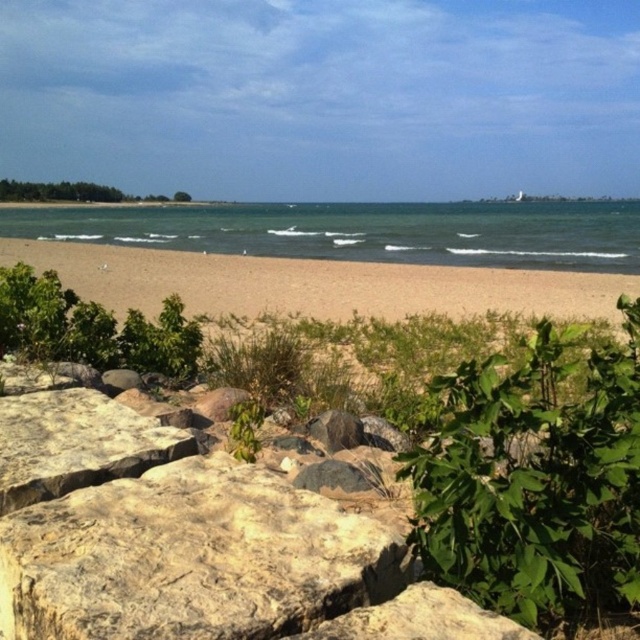
Question: In this image, where is brown rough rock at lower left located relative to green leafy bush at lower left?

Choices:
 (A) right
 (B) left

Answer: (A)

Question: Can you confirm if brown sandy beach at center is smaller than rough textured rock at lower left?

Choices:
 (A) yes
 (B) no

Answer: (B)

Question: Does brown sandy beach at center appear under rough textured rock at lower left?

Choices:
 (A) no
 (B) yes

Answer: (A)

Question: Among these objects, which one is farthest from the camera?

Choices:
 (A) brown sandy beach at center
 (B) smooth gray rock at center
 (C) green leafy plant at center
 (D) green leafy bush at lower left

Answer: (A)

Question: Based on their relative distances, which object is nearer to the green leafy shrubs at left?

Choices:
 (A) brown rough rock at lower left
 (B) smooth gray rock at center

Answer: (A)

Question: Among these points, which one is farthest from the camera?

Choices:
 (A) (518, 627)
 (B) (381, 304)
 (C) (634, 477)

Answer: (B)